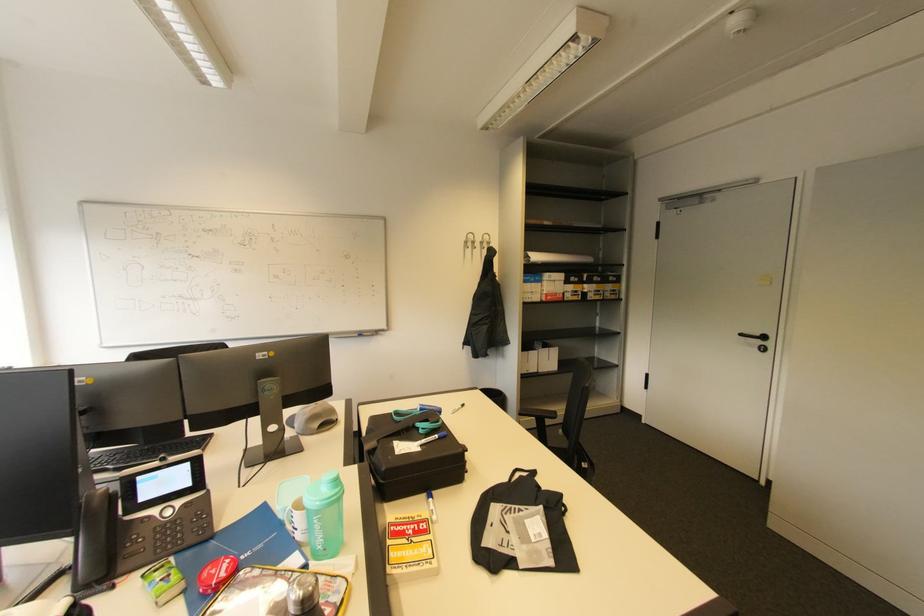
I want to click on white marker, so click(x=431, y=506).